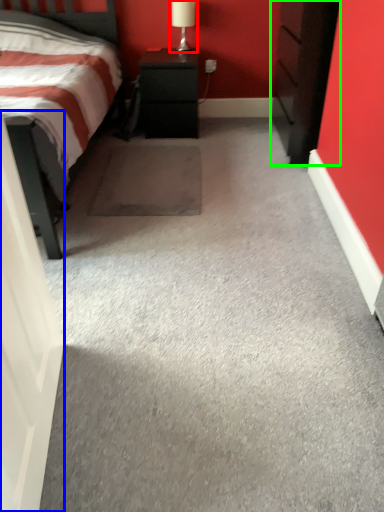
Question: Considering the real-world distances, which object is farthest from table lamp (highlighted by a red box)? door (highlighted by a blue box) or chest of drawers (highlighted by a green box)?

Choices:
 (A) door
 (B) chest of drawers

Answer: (A)